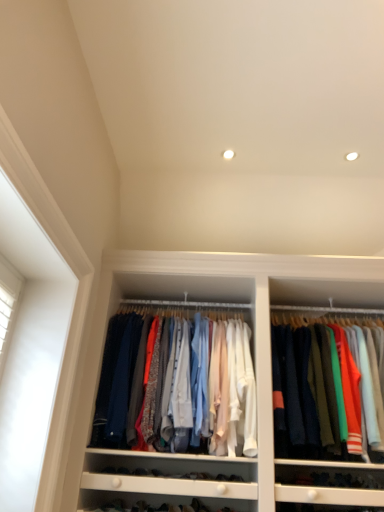
You are a GUI agent. You are given a task and a screenshot of the screen. Output one action in this format:
    pyautogui.click(x=<x>, y=<y>)
    Task: Click on the matte cotton shirts at center, acting as the first clothing starting from the left
    
    Given the screenshot: What is the action you would take?
    pyautogui.click(x=199, y=387)

Describe the element at coordinates (199, 387) in the screenshot. I see `matte cotton shirts at center, acting as the first clothing starting from the left` at that location.

What are the coordinates of `knit sweater at upper right, arranged as the first clothing when viewed from the right` in the screenshot? It's located at (304, 392).

What do you see at coordinates (304, 392) in the screenshot? I see `knit sweater at upper right, the 2th clothing when ordered from left to right` at bounding box center [304, 392].

In order to face knit sweater at upper right, the 2th clothing when ordered from left to right, should I rotate leftwards or rightwards?

A 18.869 degree turn to the right will do.

Find the location of a particular element. The height and width of the screenshot is (512, 384). matte cotton shirts at center, acting as the first clothing starting from the left is located at coordinates pos(199,387).

Based on the photo, is knit sweater at upper right, arranged as the first clothing when viewed from the right, at the right side of matte cotton shirts at center, acting as the first clothing starting from the left?

Indeed, knit sweater at upper right, arranged as the first clothing when viewed from the right, is positioned on the right side of matte cotton shirts at center, acting as the first clothing starting from the left.

Considering their positions, is knit sweater at upper right, arranged as the first clothing when viewed from the right, located in front of or behind matte cotton shirts at center, acting as the first clothing starting from the left?

Visually, knit sweater at upper right, arranged as the first clothing when viewed from the right, is located in front of matte cotton shirts at center, acting as the first clothing starting from the left.

Does point (289, 332) lie in front of point (243, 387)?

No, (289, 332) is behind (243, 387).

From the image's perspective, is knit sweater at upper right, arranged as the first clothing when viewed from the right, above matte cotton shirts at center, acting as the first clothing starting from the left?

No, from the image's perspective, knit sweater at upper right, arranged as the first clothing when viewed from the right, is not over matte cotton shirts at center, acting as the first clothing starting from the left.

Based on the photo, from a real-world perspective, who is located lower, knit sweater at upper right, the 2th clothing when ordered from left to right, or matte cotton shirts at center, the second clothing positioned from the right?

In real-world perspective, knit sweater at upper right, the 2th clothing when ordered from left to right, is lower.

Considering the relative sizes of knit sweater at upper right, the 2th clothing when ordered from left to right, and matte cotton shirts at center, the second clothing positioned from the right, in the image provided, is knit sweater at upper right, the 2th clothing when ordered from left to right, wider than matte cotton shirts at center, the second clothing positioned from the right,?

Yes.

In terms of height, does knit sweater at upper right, the 2th clothing when ordered from left to right, look taller or shorter compared to matte cotton shirts at center, the second clothing positioned from the right?

Considering their sizes, knit sweater at upper right, the 2th clothing when ordered from left to right, has more height than matte cotton shirts at center, the second clothing positioned from the right.

In terms of size, does knit sweater at upper right, arranged as the first clothing when viewed from the right, appear bigger or smaller than matte cotton shirts at center, acting as the first clothing starting from the left?

In the image, knit sweater at upper right, arranged as the first clothing when viewed from the right, appears to be larger than matte cotton shirts at center, acting as the first clothing starting from the left.

Is knit sweater at upper right, arranged as the first clothing when viewed from the right, inside or outside of matte cotton shirts at center, acting as the first clothing starting from the left?

knit sweater at upper right, arranged as the first clothing when viewed from the right, is spatially situated outside matte cotton shirts at center, acting as the first clothing starting from the left.

Is knit sweater at upper right, arranged as the first clothing when viewed from the right, next to matte cotton shirts at center, the second clothing positioned from the right, and touching it?

There is a gap between knit sweater at upper right, arranged as the first clothing when viewed from the right, and matte cotton shirts at center, the second clothing positioned from the right.

Does knit sweater at upper right, arranged as the first clothing when viewed from the right, turn towards matte cotton shirts at center, acting as the first clothing starting from the left?

No.

Looking at this image, what's the angular difference between knit sweater at upper right, arranged as the first clothing when viewed from the right, and matte cotton shirts at center, the second clothing positioned from the right,'s facing directions?

knit sweater at upper right, arranged as the first clothing when viewed from the right, and matte cotton shirts at center, the second clothing positioned from the right, are facing 0.381 degrees away from each other.

Where is `clothing in front of the matte cotton shirts at center, acting as the first clothing starting from the left`? clothing in front of the matte cotton shirts at center, acting as the first clothing starting from the left is located at coordinates (304, 392).

Visually, is matte cotton shirts at center, acting as the first clothing starting from the left, positioned to the left or to the right of knit sweater at upper right, the 2th clothing when ordered from left to right?

Based on their positions, matte cotton shirts at center, acting as the first clothing starting from the left, is located to the left of knit sweater at upper right, the 2th clothing when ordered from left to right.

Is the position of matte cotton shirts at center, acting as the first clothing starting from the left, more distant than that of knit sweater at upper right, arranged as the first clothing when viewed from the right?

Yes, matte cotton shirts at center, acting as the first clothing starting from the left, is further from the viewer.

Is point (176, 371) closer to camera compared to point (308, 366)?

Yes, point (176, 371) is closer to viewer.

From the image's perspective, which is below, matte cotton shirts at center, acting as the first clothing starting from the left, or knit sweater at upper right, the 2th clothing when ordered from left to right?

From the image's view, knit sweater at upper right, the 2th clothing when ordered from left to right, is below.

From a real-world perspective, which object rests below the other?

From a 3D spatial view, knit sweater at upper right, arranged as the first clothing when viewed from the right, is below.

Between matte cotton shirts at center, acting as the first clothing starting from the left, and knit sweater at upper right, arranged as the first clothing when viewed from the right, which one has larger width?

knit sweater at upper right, arranged as the first clothing when viewed from the right.

From their relative heights in the image, would you say matte cotton shirts at center, the second clothing positioned from the right, is taller or shorter than knit sweater at upper right, the 2th clothing when ordered from left to right?

Clearly, matte cotton shirts at center, the second clothing positioned from the right, is shorter compared to knit sweater at upper right, the 2th clothing when ordered from left to right.

Who is smaller, matte cotton shirts at center, acting as the first clothing starting from the left, or knit sweater at upper right, the 2th clothing when ordered from left to right?

matte cotton shirts at center, acting as the first clothing starting from the left.

Would you say matte cotton shirts at center, the second clothing positioned from the right, is inside or outside knit sweater at upper right, arranged as the first clothing when viewed from the right?

matte cotton shirts at center, the second clothing positioned from the right, is spatially situated outside knit sweater at upper right, arranged as the first clothing when viewed from the right.

Is matte cotton shirts at center, acting as the first clothing starting from the left, touching knit sweater at upper right, arranged as the first clothing when viewed from the right?

No, matte cotton shirts at center, acting as the first clothing starting from the left, is not with knit sweater at upper right, arranged as the first clothing when viewed from the right.

Is matte cotton shirts at center, acting as the first clothing starting from the left, oriented away from knit sweater at upper right, arranged as the first clothing when viewed from the right?

No, matte cotton shirts at center, acting as the first clothing starting from the left, is not facing away from knit sweater at upper right, arranged as the first clothing when viewed from the right.

How many degrees apart are the facing directions of matte cotton shirts at center, the second clothing positioned from the right, and knit sweater at upper right, the 2th clothing when ordered from left to right?

The angle between the facing direction of matte cotton shirts at center, the second clothing positioned from the right, and the facing direction of knit sweater at upper right, the 2th clothing when ordered from left to right, is 0.381 degrees.

Measure the distance from matte cotton shirts at center, the second clothing positioned from the right, to knit sweater at upper right, arranged as the first clothing when viewed from the right.

matte cotton shirts at center, the second clothing positioned from the right, and knit sweater at upper right, arranged as the first clothing when viewed from the right, are 41.82 centimeters apart from each other.

Where is `clothing that is on the left side of knit sweater at upper right, the 2th clothing when ordered from left to right`? clothing that is on the left side of knit sweater at upper right, the 2th clothing when ordered from left to right is located at coordinates (199, 387).

In order to click on clothing in front of the matte cotton shirts at center, the second clothing positioned from the right in this screenshot , I will do `click(304, 392)`.

The width and height of the screenshot is (384, 512). What are the coordinates of `clothing that is above the knit sweater at upper right, arranged as the first clothing when viewed from the right (from a real-world perspective)` in the screenshot? It's located at tap(199, 387).